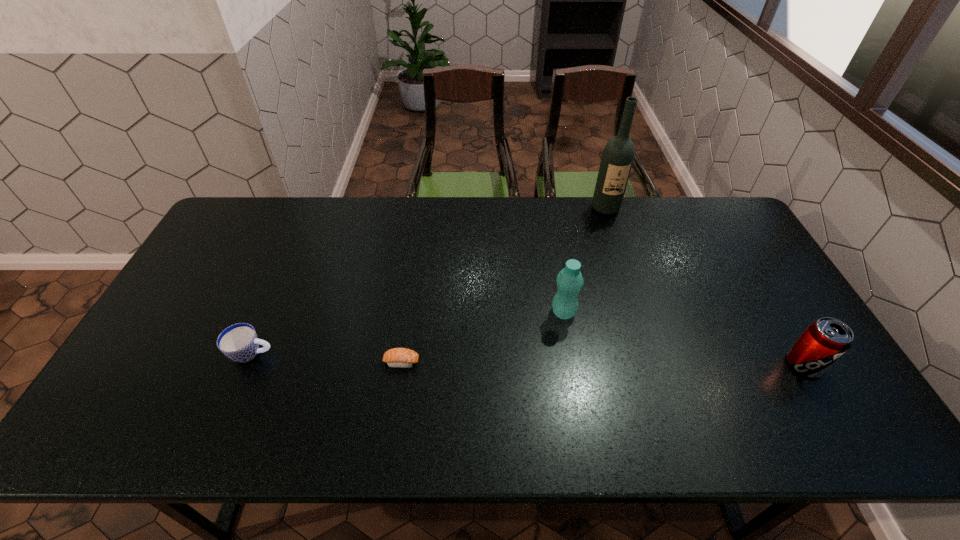
The width and height of the screenshot is (960, 540). In the image, there is a desktop. Find the location of `vacant region at the right edge`. vacant region at the right edge is located at coordinates (730, 279).

I want to click on unoccupied position between the soda can and the second object from left to right, so click(603, 363).

Locate an element on the screen. The image size is (960, 540). vacant space that's between the farthest object and the rightmost object is located at coordinates (705, 286).

You are a GUI agent. You are given a task and a screenshot of the screen. Output one action in this format:
    pyautogui.click(x=<x>, y=<y>)
    Task: Click on the empty space that is in between the rightmost object and the shortest object
    This screenshot has width=960, height=540.
    Given the screenshot: What is the action you would take?
    pyautogui.click(x=603, y=363)

What are the coordinates of `vacant area that lies between the third shortest object and the fourth shortest object` in the screenshot? It's located at (684, 338).

At what (x,y) coordinates should I click in order to perform the action: click on vacant region between the bottle and the shortest object. Please return your answer as a coordinate pair (x, y). This screenshot has height=540, width=960. Looking at the image, I should click on (483, 338).

You are a GUI agent. You are given a task and a screenshot of the screen. Output one action in this format:
    pyautogui.click(x=<x>, y=<y>)
    Task: Click on the vacant region between the wine bottle and the second shortest object
    
    Given the screenshot: What is the action you would take?
    pyautogui.click(x=428, y=281)

Locate an element on the screen. This screenshot has width=960, height=540. free space that is in between the soda can and the fourth shortest object is located at coordinates (684, 338).

Locate an element on the screen. This screenshot has height=540, width=960. free space between the second object from left to right and the farthest object is located at coordinates (503, 285).

You are a GUI agent. You are given a task and a screenshot of the screen. Output one action in this format:
    pyautogui.click(x=<x>, y=<y>)
    Task: Click on the free space between the second farthest object and the third tallest object
    This screenshot has height=540, width=960.
    Given the screenshot: What is the action you would take?
    pyautogui.click(x=684, y=338)